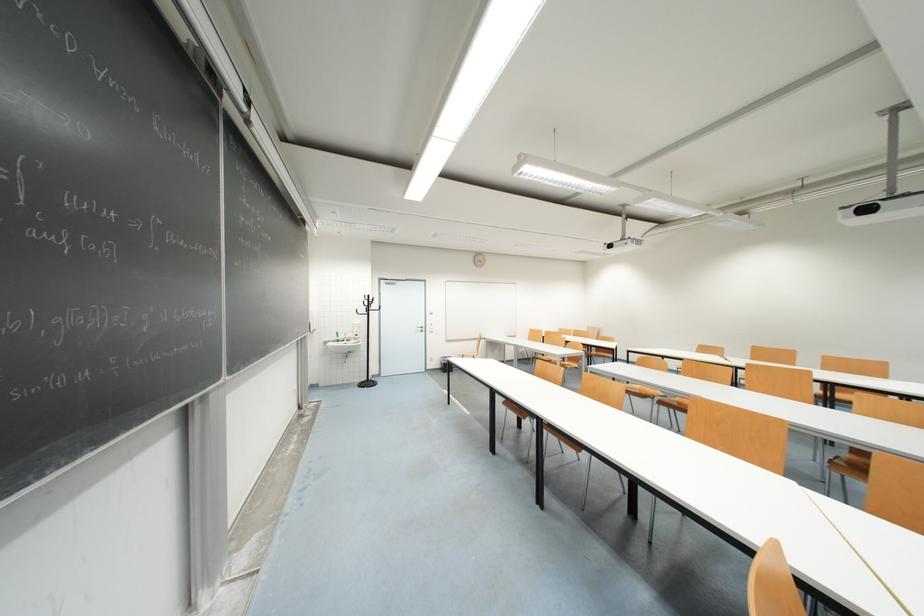
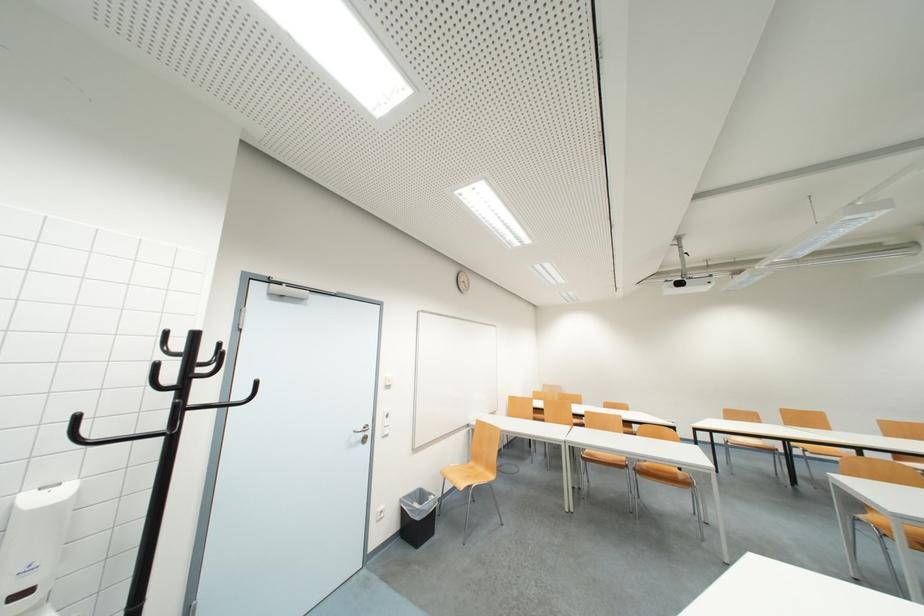
Find the pixel in the second image that matches point 709,351 in the first image.

(736, 416)